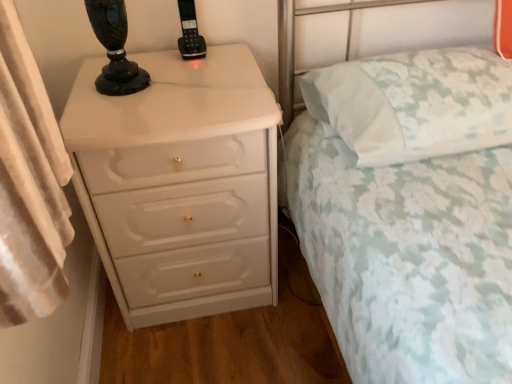
Question: Does white glossy chest of drawers at left have a lesser height compared to white floral fabric bed at center?

Choices:
 (A) yes
 (B) no

Answer: (A)

Question: Is white glossy chest of drawers at left facing towards white floral fabric bed at center?

Choices:
 (A) yes
 (B) no

Answer: (B)

Question: Does white glossy chest of drawers at left come behind white floral fabric bed at center?

Choices:
 (A) yes
 (B) no

Answer: (A)

Question: From a real-world perspective, is white glossy chest of drawers at left located beneath white floral fabric bed at center?

Choices:
 (A) yes
 (B) no

Answer: (A)

Question: Can you confirm if white glossy chest of drawers at left is positioned to the right of white floral fabric bed at center?

Choices:
 (A) yes
 (B) no

Answer: (B)

Question: From a real-world perspective, does white glossy chest of drawers at left stand above white floral fabric bed at center?

Choices:
 (A) no
 (B) yes

Answer: (A)

Question: Is white glossy chest of drawers at left touching white floral fabric pillow at upper right?

Choices:
 (A) yes
 (B) no

Answer: (B)

Question: Is white glossy chest of drawers at left facing away from white floral fabric pillow at upper right?

Choices:
 (A) no
 (B) yes

Answer: (A)

Question: Could you tell me if white glossy chest of drawers at left is turned towards white floral fabric pillow at upper right?

Choices:
 (A) no
 (B) yes

Answer: (A)

Question: Is white glossy chest of drawers at left not close to white floral fabric pillow at upper right?

Choices:
 (A) yes
 (B) no

Answer: (B)

Question: Can you confirm if white glossy chest of drawers at left is taller than white floral fabric pillow at upper right?

Choices:
 (A) yes
 (B) no

Answer: (A)

Question: Considering the relative sizes of white glossy chest of drawers at left and white floral fabric pillow at upper right in the image provided, is white glossy chest of drawers at left wider than white floral fabric pillow at upper right?

Choices:
 (A) no
 (B) yes

Answer: (B)

Question: From a real-world perspective, is white floral fabric bed at center positioned over white floral fabric pillow at upper right based on gravity?

Choices:
 (A) no
 (B) yes

Answer: (A)